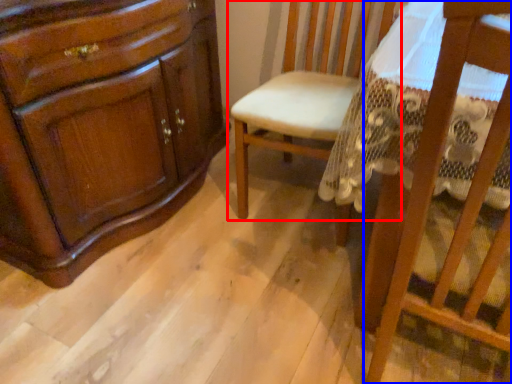
Question: Among these objects, which one is farthest to the camera, chair (highlighted by a red box) or chair (highlighted by a blue box)?

Choices:
 (A) chair
 (B) chair

Answer: (A)